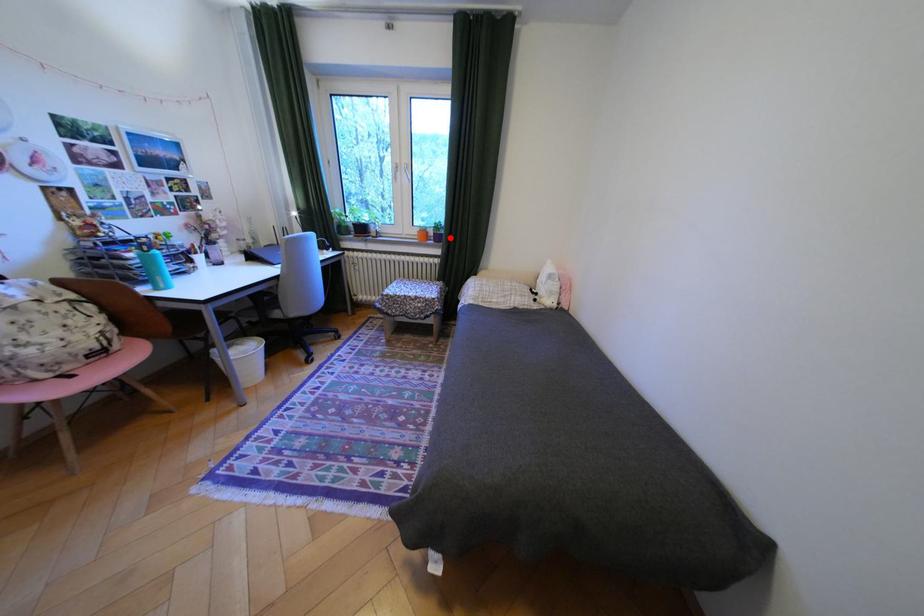
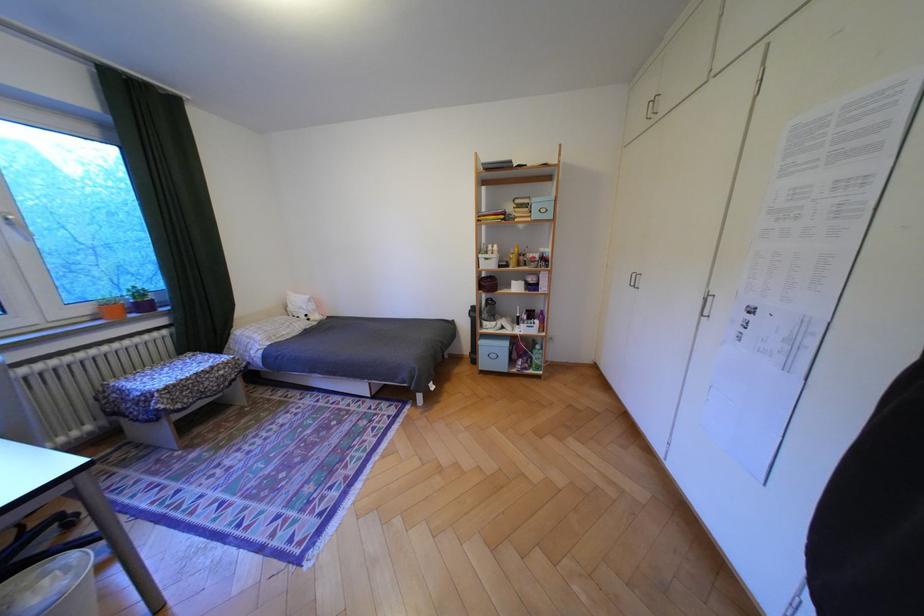
Question: I am providing you with two images of the same scene from different viewpoints. Image1 has a red point marked. In image2, the corresponding 3D location appears at what relative position? Reply with the corresponding letter.

Choices:
 (A) Closer
 (B) Farther

Answer: (B)